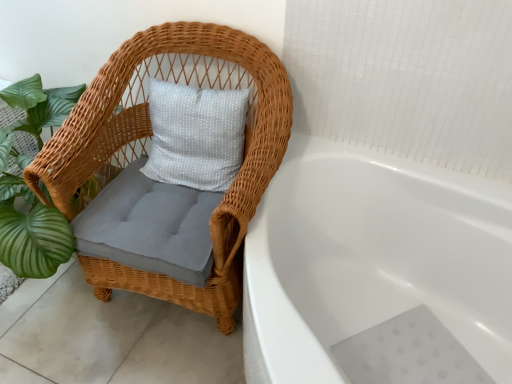
Question: Is white glossy bathtub at center to the left or to the right of woven wicker chair at left in the image?

Choices:
 (A) right
 (B) left

Answer: (A)

Question: From their relative heights in the image, would you say white glossy bathtub at center is taller or shorter than woven wicker chair at left?

Choices:
 (A) tall
 (B) short

Answer: (B)

Question: In terms of size, does white glossy bathtub at center appear bigger or smaller than woven wicker chair at left?

Choices:
 (A) small
 (B) big

Answer: (B)

Question: Is woven wicker chair at left taller or shorter than white glossy bathtub at center?

Choices:
 (A) tall
 (B) short

Answer: (A)

Question: Considering the positions of point (32, 177) and point (454, 198), is point (32, 177) closer or farther from the camera than point (454, 198)?

Choices:
 (A) closer
 (B) farther

Answer: (A)

Question: Would you say woven wicker chair at left is to the left or to the right of white glossy bathtub at center in the picture?

Choices:
 (A) left
 (B) right

Answer: (A)

Question: Is woven wicker chair at left inside or outside of white glossy bathtub at center?

Choices:
 (A) inside
 (B) outside

Answer: (B)